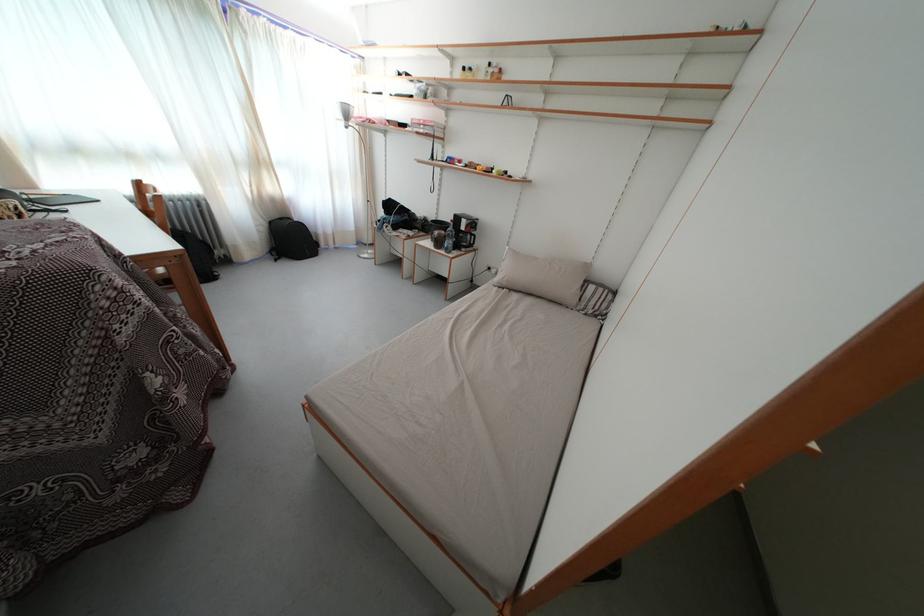
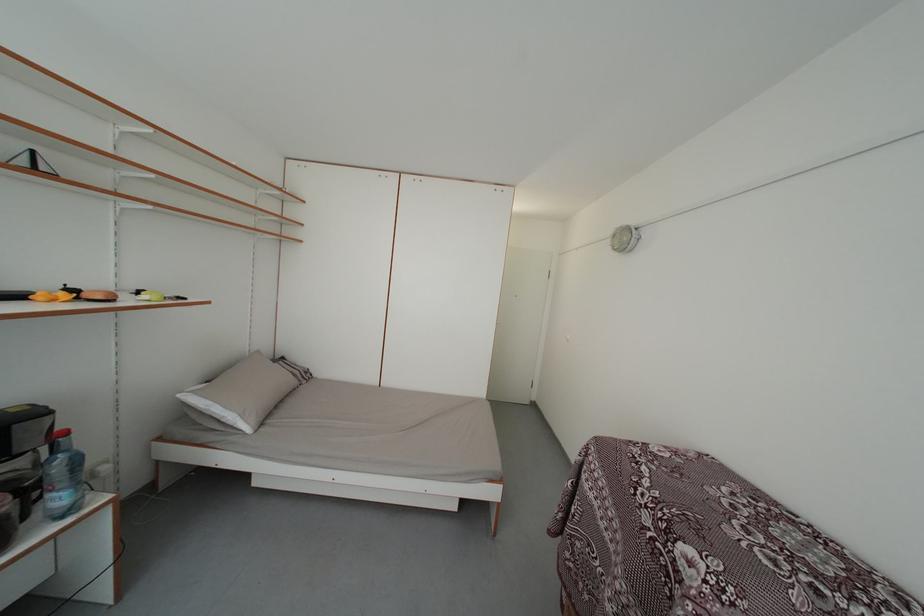
In the second image, find the point that corresponds to the point at 622,299 in the first image.

(289, 365)